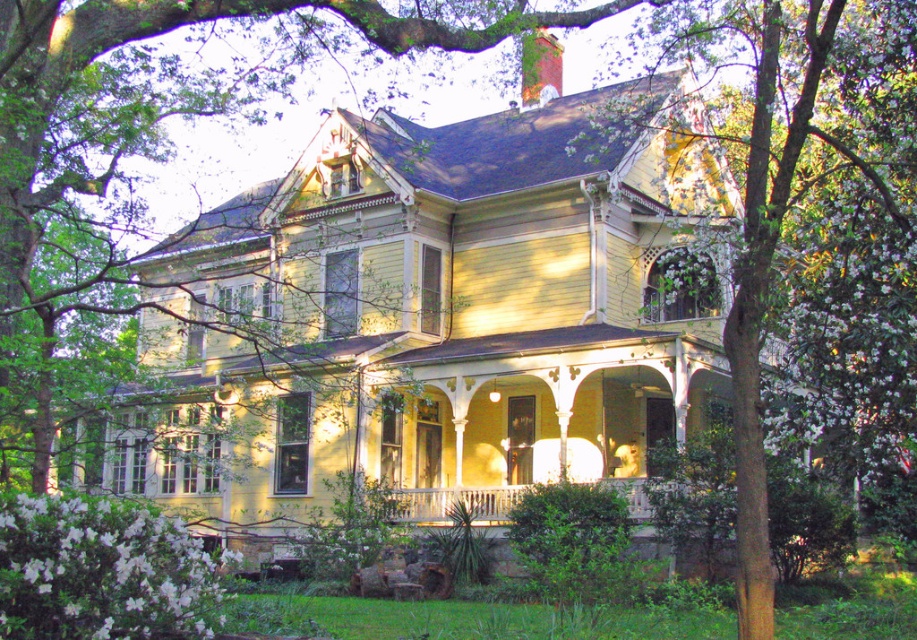
Who is positioned more to the right, green leafy tree at center or white wooden porch at center?

Positioned to the right is green leafy tree at center.

Is green leafy tree at center closer to the viewer compared to white wooden porch at center?

That is True.

Find the location of a particular element. The image size is (917, 640). green leafy tree at center is located at coordinates (768, 289).